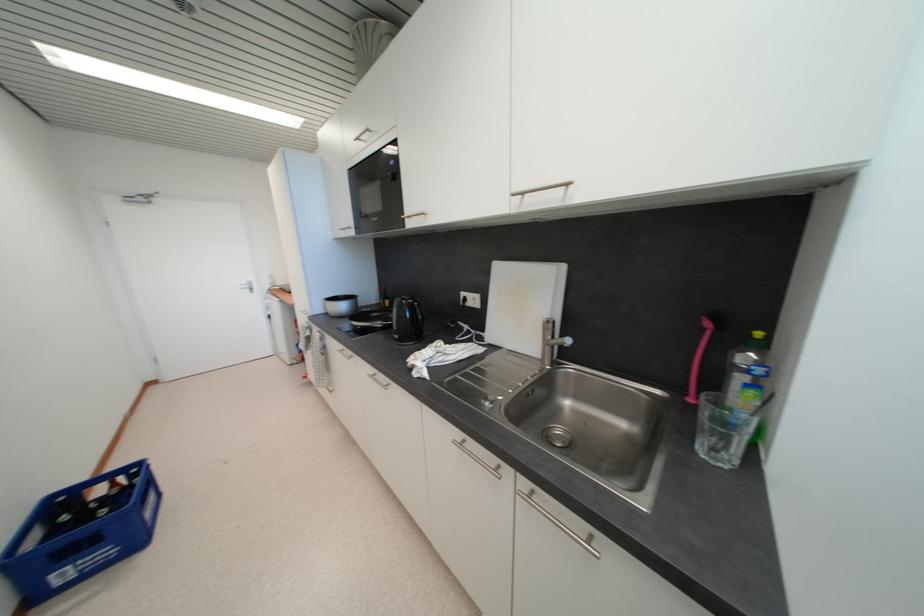
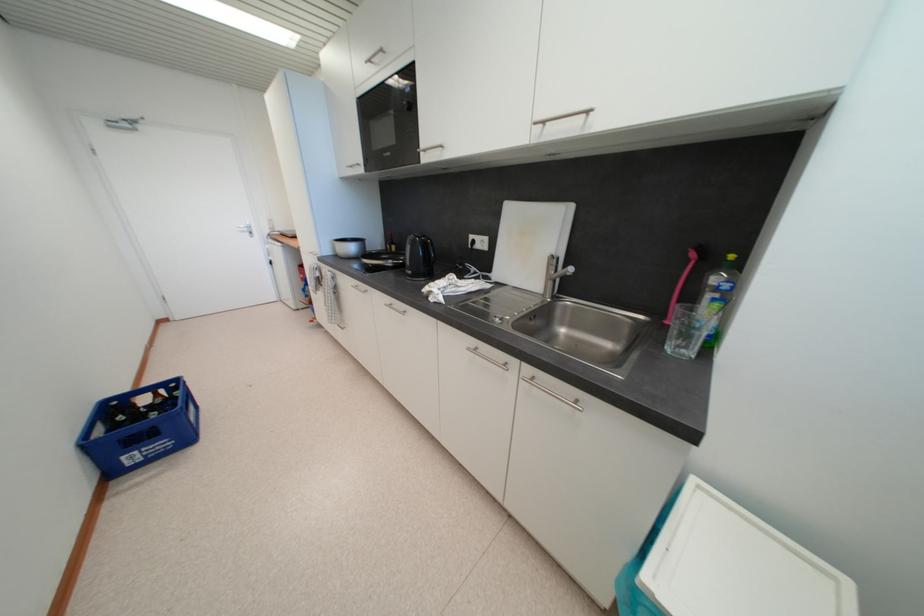
Locate, in the second image, the point that corresponds to (x=346, y=349) in the first image.

(359, 285)